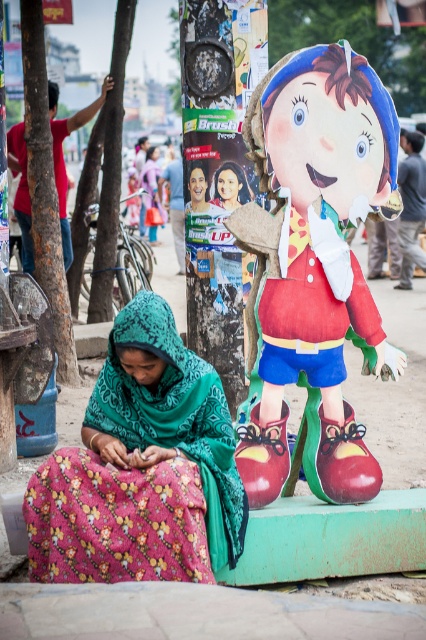
Based on the photo, who is more forward, (264, 227) or (227, 209)?

Point (264, 227)

Can you confirm if cardboard doll at center is thinner than matte plastic portrait at center?

Incorrect, cardboard doll at center's width is not less than matte plastic portrait at center's.

Is point (267, 138) positioned after point (216, 184)?

That is False.

In order to click on cardboard doll at center in this screenshot , I will do `click(313, 260)`.

Is floral fabric scarf at lower left further to camera compared to matte plastic portrait at center?

That is False.

Where is `floral fabric scarf at lower left`? floral fabric scarf at lower left is located at coordinates (141, 468).

Does cardboard doll at center have a smaller size compared to floral fabric scarf at lower left?

No.

Which is more to the right, cardboard doll at center or floral fabric scarf at lower left?

Positioned to the right is cardboard doll at center.

Describe the element at coordinates (313, 260) in the screenshot. This screenshot has height=640, width=426. I see `cardboard doll at center` at that location.

Where is `cardboard doll at center`? The image size is (426, 640). cardboard doll at center is located at coordinates (313, 260).